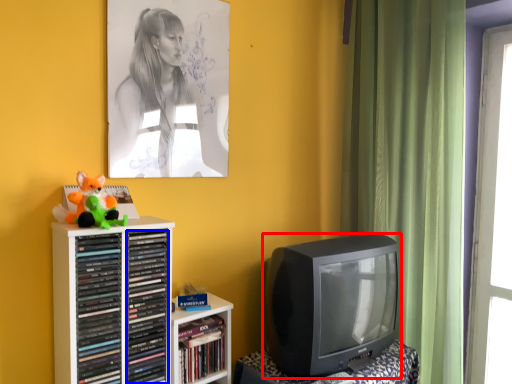
Question: Which of the following is the closest to the observer, television (highlighted by a red box) or book (highlighted by a blue box)?

Choices:
 (A) television
 (B) book

Answer: (B)